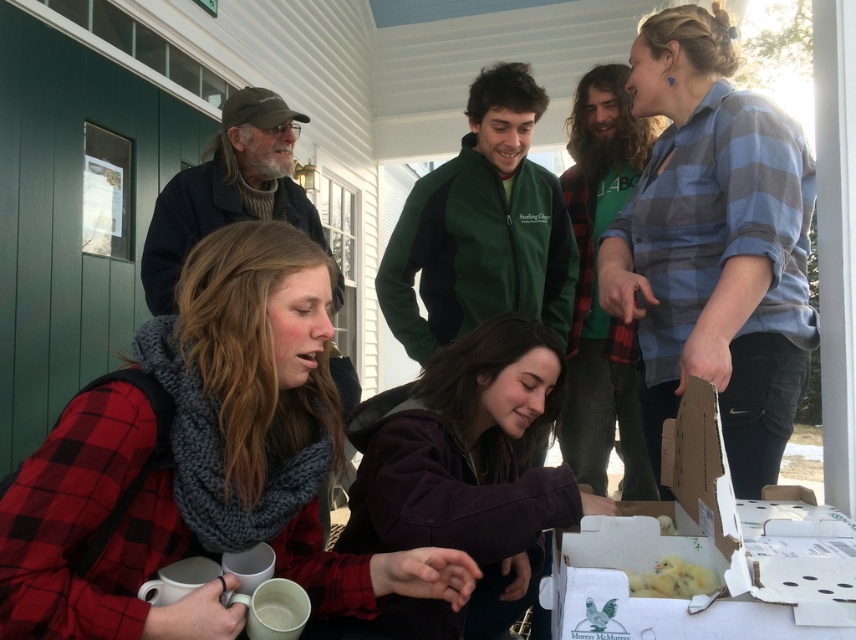
Question: Based on their relative distances, which object is farther from the white cardboard box at lower right?

Choices:
 (A) yellow fluffy chicks at lower center
 (B) red plaid shirt at lower left

Answer: (B)

Question: Can you confirm if blue plaid shirt at upper right is smaller than yellow fluffy chicks at lower center?

Choices:
 (A) yes
 (B) no

Answer: (B)

Question: Which object is positioned farthest from the purple soft fabric at center?

Choices:
 (A) yellow fluffy chicks at lower center
 (B) blue plaid shirt at upper right
 (C) white cardboard box at lower right

Answer: (B)

Question: Among these objects, which one is nearest to the camera?

Choices:
 (A) purple soft fabric at center
 (B) blue plaid shirt at upper right
 (C) red plaid shirt at lower left
 (D) white cardboard box at lower right

Answer: (D)

Question: Does purple soft fabric at center appear on the left side of yellow fluffy chicks at lower center?

Choices:
 (A) no
 (B) yes

Answer: (B)

Question: Is blue plaid shirt at upper right to the right of white cardboard box at lower right from the viewer's perspective?

Choices:
 (A) no
 (B) yes

Answer: (B)